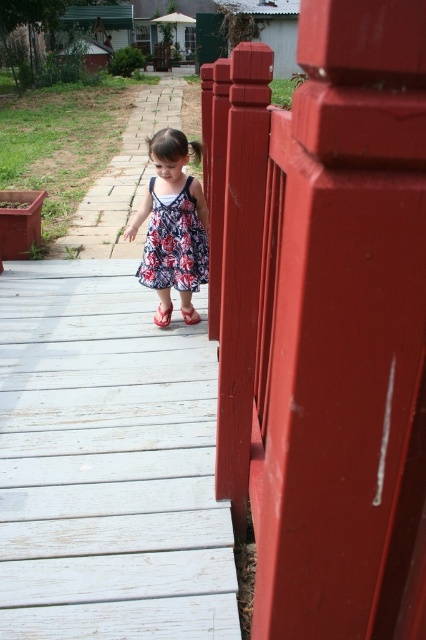
Is white wood path at center below red rubber sandal at center?

Indeed, white wood path at center is positioned under red rubber sandal at center.

Which is in front, point (83, 488) or point (161, 324)?

Point (83, 488) is more forward.

Image resolution: width=426 pixels, height=640 pixels. I want to click on white wood path at center, so click(106, 464).

The image size is (426, 640). I want to click on white wood path at center, so click(106, 464).

Who is shorter, floral dress at center or red rubber sandal at center?

Standing shorter between the two is red rubber sandal at center.

Does floral dress at center have a lesser width compared to red rubber sandal at center?

Incorrect, floral dress at center's width is not less than red rubber sandal at center's.

Where is `floral dress at center`? This screenshot has height=640, width=426. floral dress at center is located at coordinates (172, 221).

Can you confirm if white wood path at center is smaller than matte pink sandal at center?

Actually, white wood path at center might be larger than matte pink sandal at center.

Does white wood path at center have a greater height compared to matte pink sandal at center?

Yes, white wood path at center is taller than matte pink sandal at center.

What do you see at coordinates (106, 464) in the screenshot? I see `white wood path at center` at bounding box center [106, 464].

You are a GUI agent. You are given a task and a screenshot of the screen. Output one action in this format:
    pyautogui.click(x=<x>, y=<y>)
    Task: Click on the white wood path at center
    The width and height of the screenshot is (426, 640).
    Given the screenshot: What is the action you would take?
    pyautogui.click(x=106, y=464)